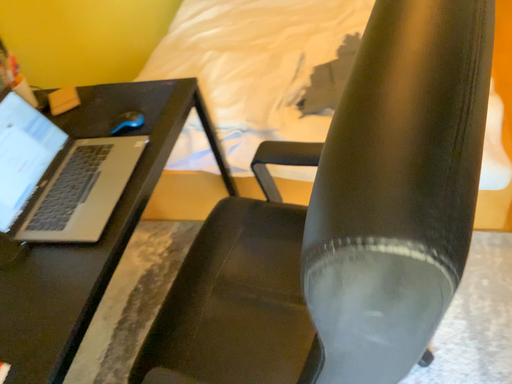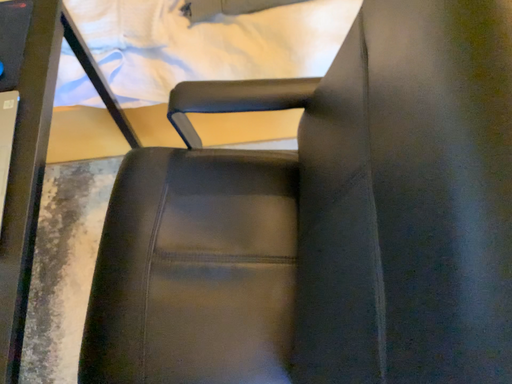
Question: How did the camera likely rotate when shooting the video?

Choices:
 (A) rotated downward
 (B) rotated upward

Answer: (A)